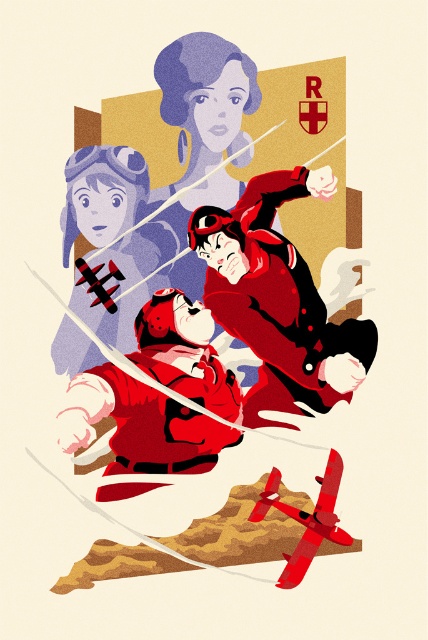
You are standing in front of the vintage illustration of the two aviators and the woman in the background. You want to know how far the matte red uniform at center is from you. Can you determine the distance?

The matte red uniform at center is 3.74 meters away from the viewer.

Based on the coordinates provided in the scene description, where is the matte red uniform at center located in the image?

The matte red uniform at center is located at the coordinates point (278, 300).